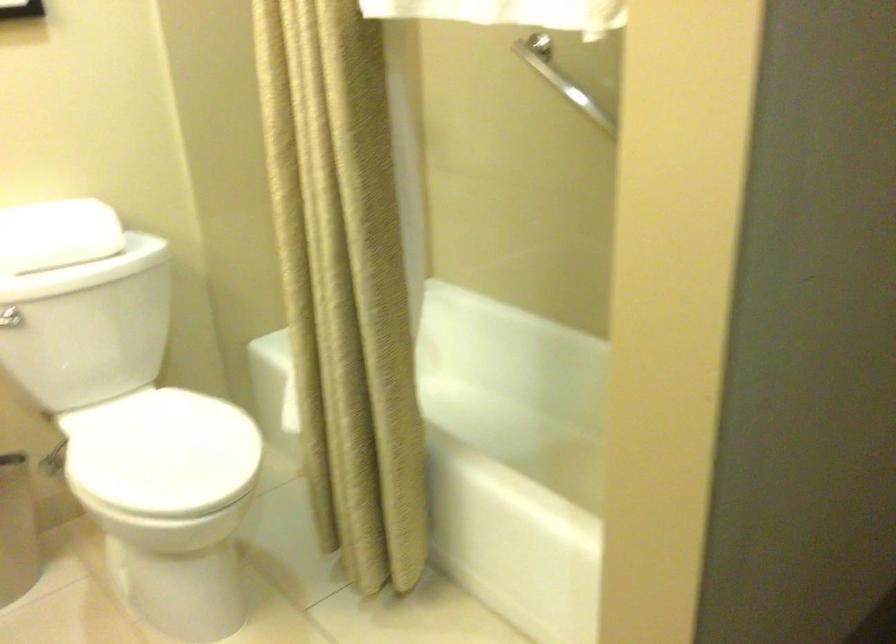
This screenshot has width=896, height=644. Describe the element at coordinates (161, 453) in the screenshot. I see `the white toilet lid` at that location.